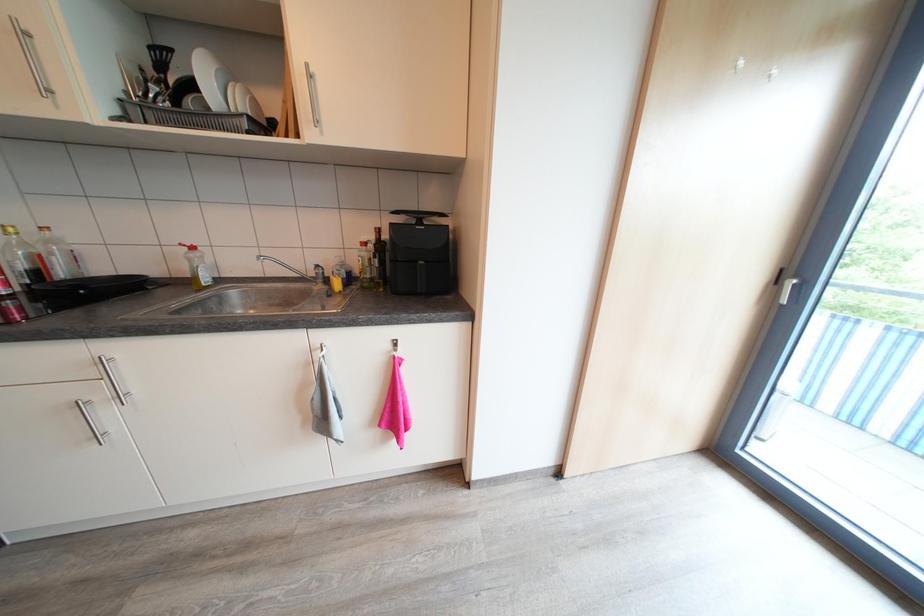
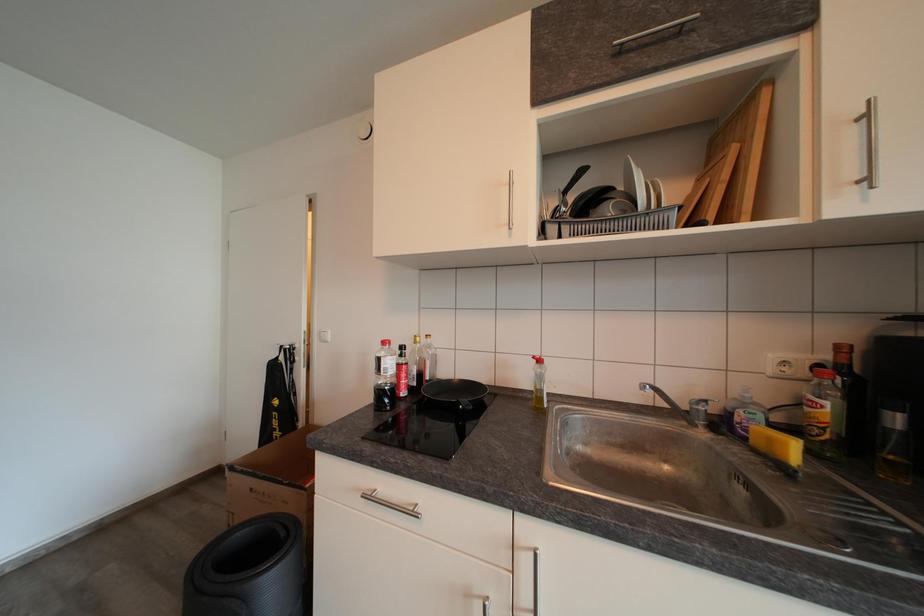
Consider the image. Based on the continuous images, in which direction is the camera rotating?

The rotation direction of the camera is left-up.